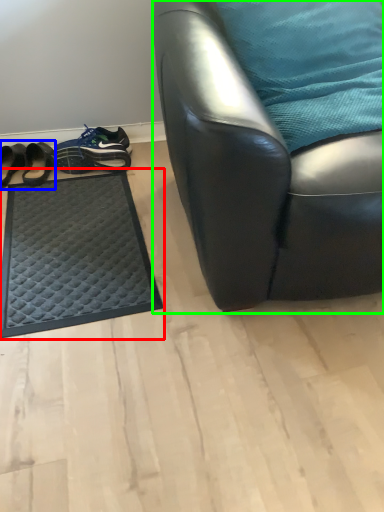
Question: Which object is the closest to the mat (highlighted by a red box)? Choose among these: footwear (highlighted by a blue box) or chair (highlighted by a green box).

Choices:
 (A) footwear
 (B) chair

Answer: (A)